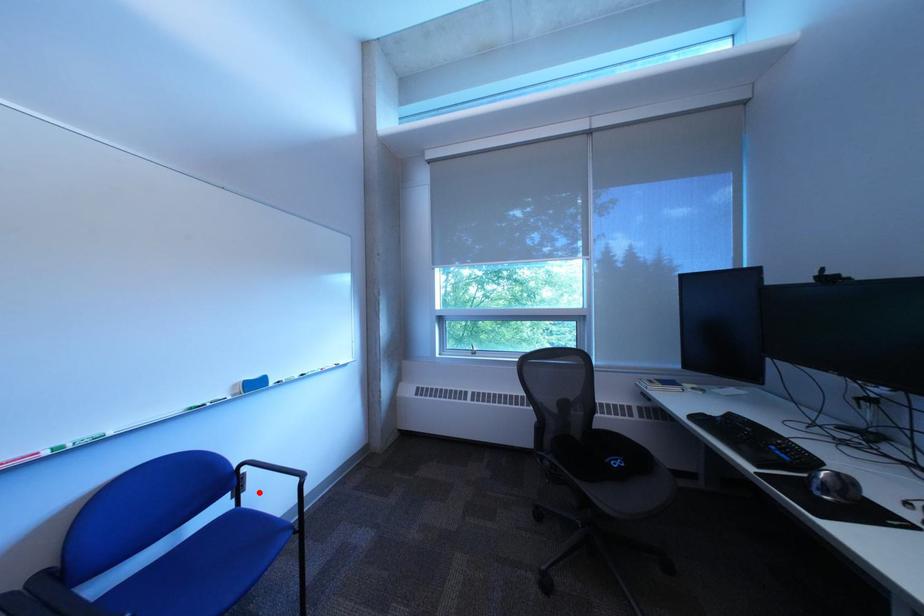
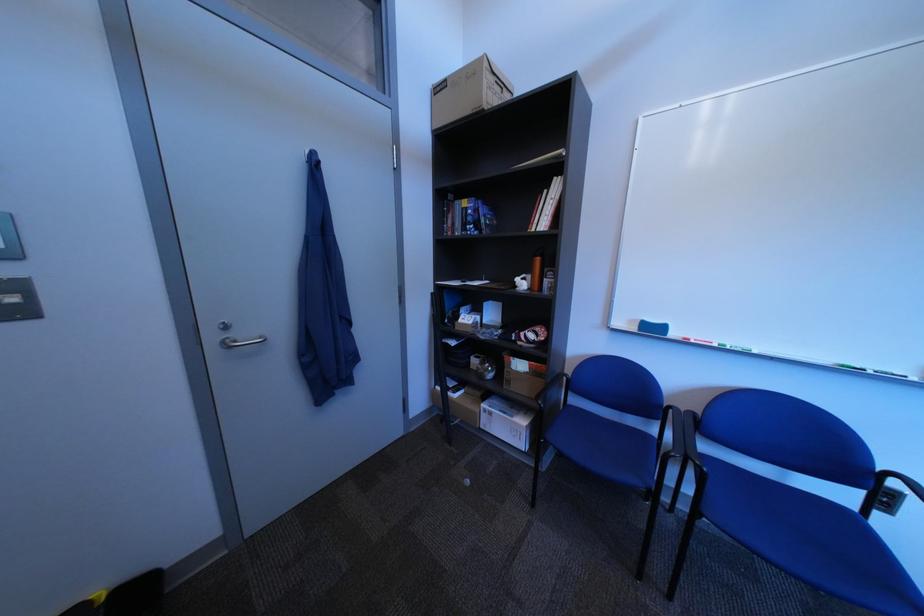
Question: I am providing you with two images of the same scene from different viewpoints. A red point is shown in image1. For the corresponding object point in image2, is it positioned nearer or farther from the camera?

Choices:
 (A) Nearer
 (B) Farther

Answer: (A)